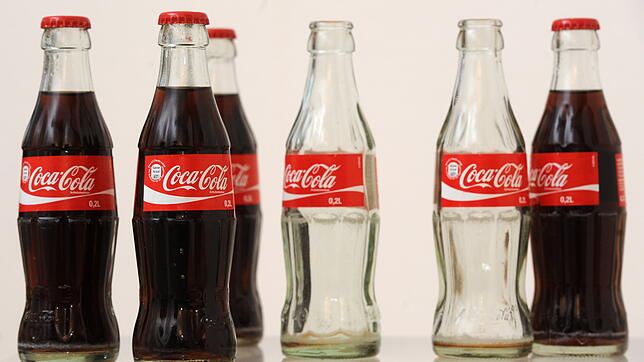
Identify the location of unopened bottles. (67, 276), (164, 280), (240, 260), (554, 274).